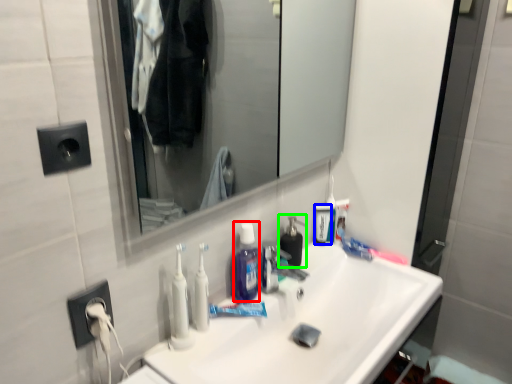
Question: Which is nearer to the mouthwash (highlighted by a red box)? mouthwash (highlighted by a blue box) or soap dispenser (highlighted by a green box).

Choices:
 (A) mouthwash
 (B) soap dispenser

Answer: (B)